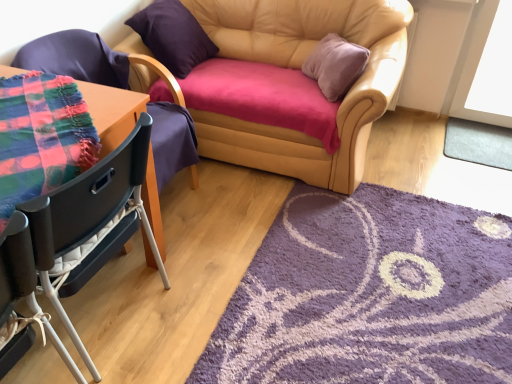
Question: Can you confirm if purple suede pillow at upper left is thinner than white plastic chair at lower left, the third chair from the back?

Choices:
 (A) no
 (B) yes

Answer: (B)

Question: Does purple suede pillow at upper left have a greater width compared to white plastic chair at lower left, the third chair from the back?

Choices:
 (A) no
 (B) yes

Answer: (A)

Question: Would you say purple suede pillow at upper left is outside white plastic chair at lower left, the third chair from the back?

Choices:
 (A) yes
 (B) no

Answer: (A)

Question: Would you say purple suede pillow at upper left is a long distance from white plastic chair at lower left, the third chair from the back?

Choices:
 (A) yes
 (B) no

Answer: (A)

Question: Can you confirm if purple suede pillow at upper left is bigger than white plastic chair at lower left, the first chair when ordered from front to back?

Choices:
 (A) yes
 (B) no

Answer: (A)

Question: From a real-world perspective, is purple suede pillow at upper left physically above white plastic chair at lower left, the first chair when ordered from front to back?

Choices:
 (A) no
 (B) yes

Answer: (B)

Question: From the image's perspective, is leather couch at center above purple shaggy rug at lower right, the 2th mat from the right?

Choices:
 (A) no
 (B) yes

Answer: (B)

Question: Is leather couch at center facing away from purple shaggy rug at lower right, arranged as the first mat when viewed from the left?

Choices:
 (A) yes
 (B) no

Answer: (B)

Question: From a real-world perspective, is leather couch at center below purple shaggy rug at lower right, arranged as the first mat when viewed from the left?

Choices:
 (A) yes
 (B) no

Answer: (B)

Question: From the image's perspective, is leather couch at center beneath purple shaggy rug at lower right, the second mat when ordered from back to front?

Choices:
 (A) no
 (B) yes

Answer: (A)

Question: Can you see leather couch at center touching purple shaggy rug at lower right, marked as the first mat in a front-to-back arrangement?

Choices:
 (A) yes
 (B) no

Answer: (B)

Question: Considering the relative sizes of leather couch at center and purple shaggy rug at lower right, arranged as the first mat when viewed from the left, in the image provided, is leather couch at center thinner than purple shaggy rug at lower right, arranged as the first mat when viewed from the left,?

Choices:
 (A) yes
 (B) no

Answer: (A)

Question: From a real-world perspective, is leather couch at center located beneath black plastic chair at left, arranged as the 2th chair when viewed from the front?

Choices:
 (A) no
 (B) yes

Answer: (A)